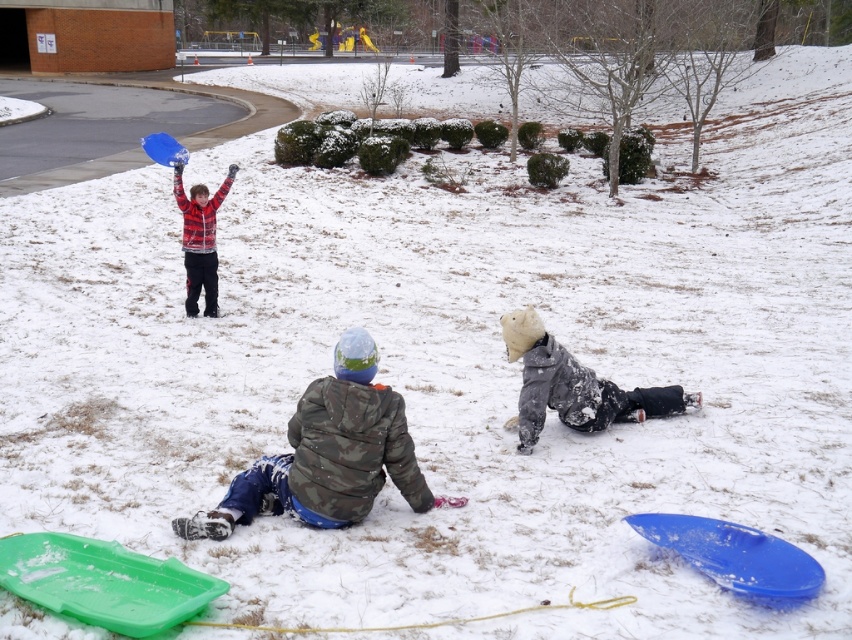
In the snowy scene, there are two children wearing the camo jacket at lower center and the plaid flannel shirt at upper left. Which child is positioned to the right of the other?

The camo jacket at lower center is to the right of the plaid flannel shirt at upper left.